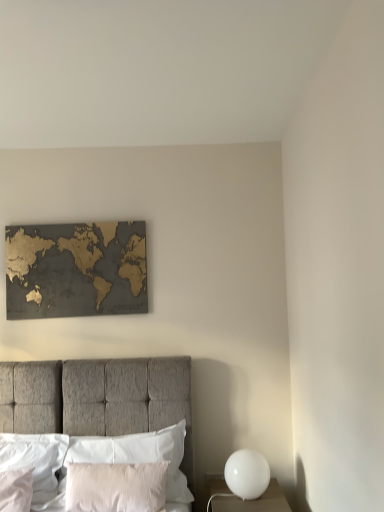
Locate an element on the screen. The image size is (384, 512). vacant point above gold metallic map at upper center (from a real-world perspective) is located at coordinates (73, 221).